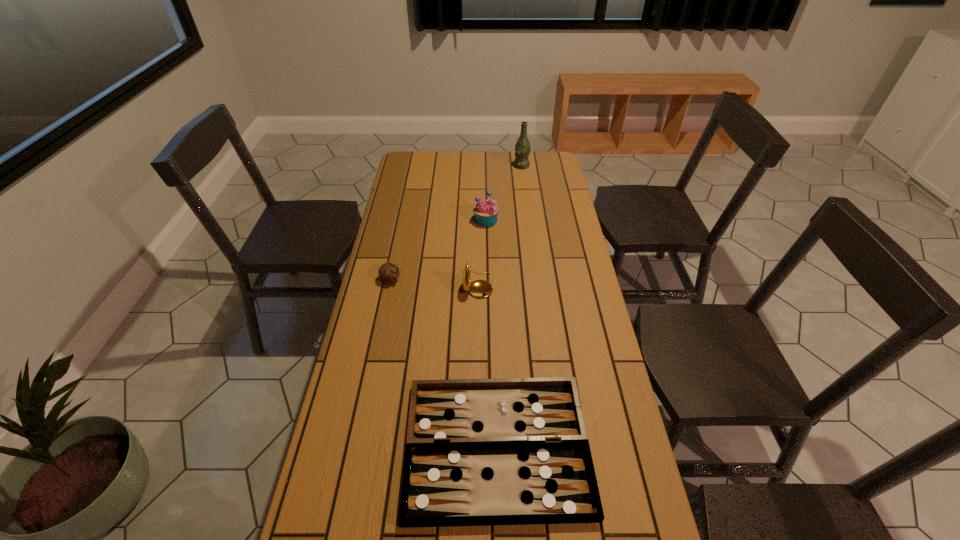
You are a GUI agent. You are given a task and a screenshot of the screen. Output one action in this format:
    pyautogui.click(x=<x>, y=<y>)
    Task: Click on the free space located on the surface of the tallest object
    The width and height of the screenshot is (960, 540).
    Given the screenshot: What is the action you would take?
    pyautogui.click(x=471, y=166)

Where is `vacant area situated 0.150m on the surface of the tallest object`? vacant area situated 0.150m on the surface of the tallest object is located at coordinates coord(482,166).

Locate an element on the screen. vacant space located on the face of the pocket watch is located at coordinates (522, 284).

Locate an element on the screen. The height and width of the screenshot is (540, 960). free space located 0.100m on the left of the second farthest object is located at coordinates (448, 220).

Where is `vacant position located 0.120m on the front of the leftmost object`? vacant position located 0.120m on the front of the leftmost object is located at coordinates (383, 313).

The image size is (960, 540). Find the location of `vacant space located 0.170m on the back of the shortest object`. vacant space located 0.170m on the back of the shortest object is located at coordinates (494, 335).

In order to click on object located at the far edge in this screenshot , I will do `click(523, 147)`.

At what (x,y) coordinates should I click in order to perform the action: click on object that is at the left edge. Please return your answer as a coordinate pair (x, y). Looking at the image, I should click on (388, 272).

Locate an element on the screen. beer bottle that is at the right edge is located at coordinates (523, 147).

This screenshot has width=960, height=540. In order to click on gameboard positioned at the right edge in this screenshot , I will do `click(510, 451)`.